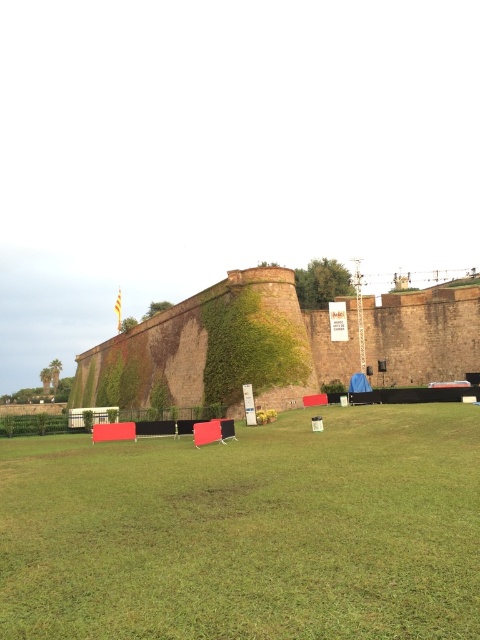
Question: Which object is the closest to the green grass at center?

Choices:
 (A) brick wall at center
 (B) green leafy hedge at lower left

Answer: (B)

Question: Is green grass at center bigger than brick wall at center?

Choices:
 (A) no
 (B) yes

Answer: (A)

Question: Is brick wall at center smaller than green leafy hedge at lower left?

Choices:
 (A) no
 (B) yes

Answer: (A)

Question: Which object is closer to the camera taking this photo?

Choices:
 (A) brick wall at center
 (B) green grass at center

Answer: (B)

Question: Which point appears closest to the camera in this image?

Choices:
 (A) (179, 595)
 (B) (16, 420)
 (C) (303, 358)

Answer: (A)

Question: Does brick wall at center have a greater width compared to green leafy hedge at lower left?

Choices:
 (A) yes
 (B) no

Answer: (A)